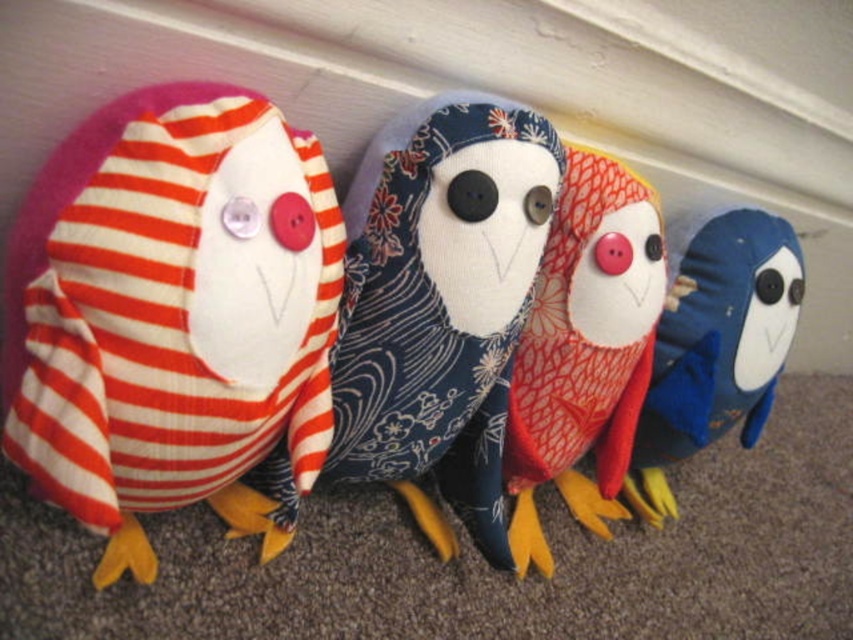
Is red textured fabric owl at center behind matte red fabric owl at center?

No.

Does point (611, 472) lie in front of point (741, 259)?

Yes, point (611, 472) is in front of point (741, 259).

Is point (550, 419) positioned before point (750, 259)?

Yes.

Find the location of `red textured fabric owl at center`. red textured fabric owl at center is located at coordinates (584, 349).

Which is more to the right, striped fabric owl at left or matte red fabric owl at center?

matte red fabric owl at center is more to the right.

Where is `striped fabric owl at left`? striped fabric owl at left is located at coordinates (170, 308).

Does striped fabric owl at left appear on the left side of red textured fabric owl at center?

Yes, striped fabric owl at left is to the left of red textured fabric owl at center.

Measure the distance from striped fabric owl at left to red textured fabric owl at center.

striped fabric owl at left and red textured fabric owl at center are 43.70 centimeters apart from each other.

Is point (270, 108) closer to viewer compared to point (587, 432)?

That is True.

This screenshot has width=853, height=640. Identify the location of striped fabric owl at left. (170, 308).